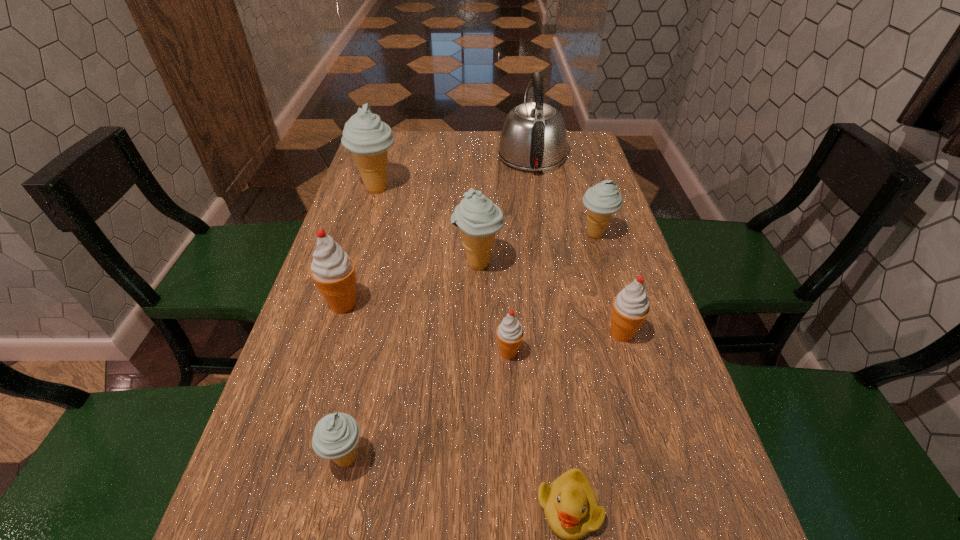
At what (x,y) coordinates should I click in order to perform the action: click on the smallest red icecream. Please return your answer as a coordinate pair (x, y). The image size is (960, 540). Looking at the image, I should click on 510,333.

The image size is (960, 540). Find the location of `the nearest icecream`. the nearest icecream is located at coordinates (336, 435).

The image size is (960, 540). What are the coordinates of `the nearest beige icecream` in the screenshot? It's located at (336, 435).

This screenshot has width=960, height=540. What are the coordinates of `vacant space situated on the right of the tallest icecream` in the screenshot? It's located at (489, 188).

The height and width of the screenshot is (540, 960). I want to click on vacant point located 0.220m on the right of the second beige icecream from right to left, so click(x=592, y=264).

Image resolution: width=960 pixels, height=540 pixels. In order to click on blank space located 0.250m on the back of the leftmost red icecream in this screenshot , I will do `click(368, 224)`.

The image size is (960, 540). Find the location of `vacant region located 0.150m on the back of the second smallest red icecream`. vacant region located 0.150m on the back of the second smallest red icecream is located at coordinates (604, 273).

The height and width of the screenshot is (540, 960). I want to click on free space located 0.330m on the back of the third farthest object, so [x=573, y=162].

Where is `free space located 0.290m on the back of the smallest red icecream`? The width and height of the screenshot is (960, 540). free space located 0.290m on the back of the smallest red icecream is located at coordinates (503, 250).

You are a GUI agent. You are given a task and a screenshot of the screen. Output one action in this format:
    pyautogui.click(x=<x>, y=<y>)
    Task: Click on the free spot located 0.350m on the right of the nearest beige icecream
    This screenshot has width=960, height=540.
    Given the screenshot: What is the action you would take?
    pyautogui.click(x=580, y=458)